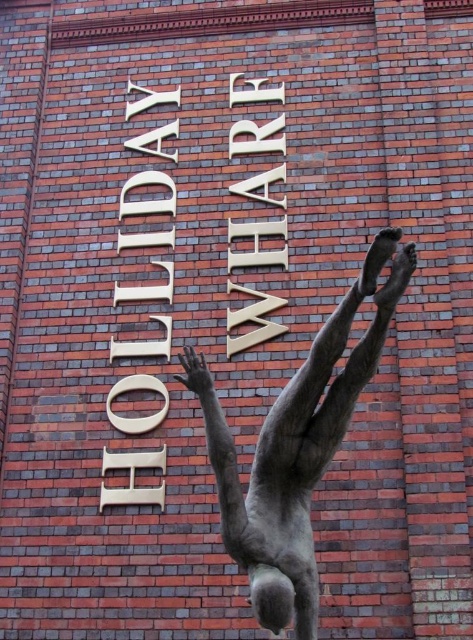
Question: Where is polished bronze diver at center located in relation to gold metallic sign at center in the image?

Choices:
 (A) below
 (B) above

Answer: (A)

Question: Which object appears closest to the camera in this image?

Choices:
 (A) polished bronze diver at center
 (B) gold metallic sign at center

Answer: (A)

Question: Where is polished bronze diver at center located in relation to gold metallic sign at center in the image?

Choices:
 (A) above
 (B) below

Answer: (B)

Question: Does polished bronze diver at center appear on the right side of gold metallic sign at center?

Choices:
 (A) yes
 (B) no

Answer: (A)

Question: Which of the following is the closest to the observer?

Choices:
 (A) polished bronze diver at center
 (B) gold metallic sign at center

Answer: (A)